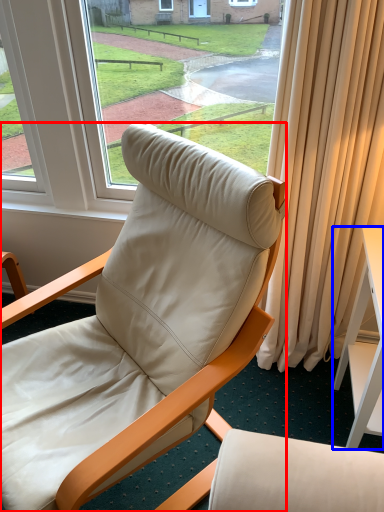
Question: Which point is further to the camera, chair (highlighted by a red box) or desk (highlighted by a blue box)?

Choices:
 (A) chair
 (B) desk

Answer: (B)